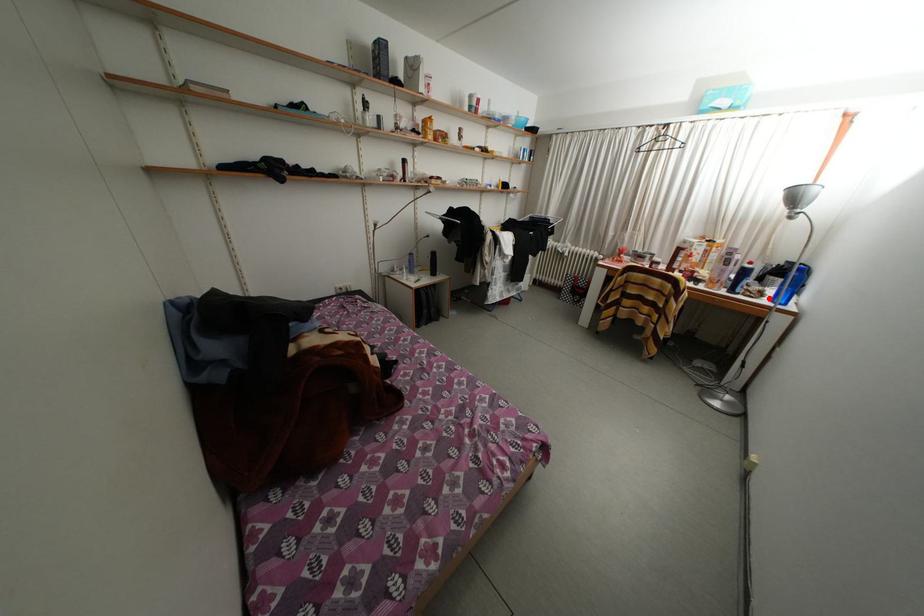
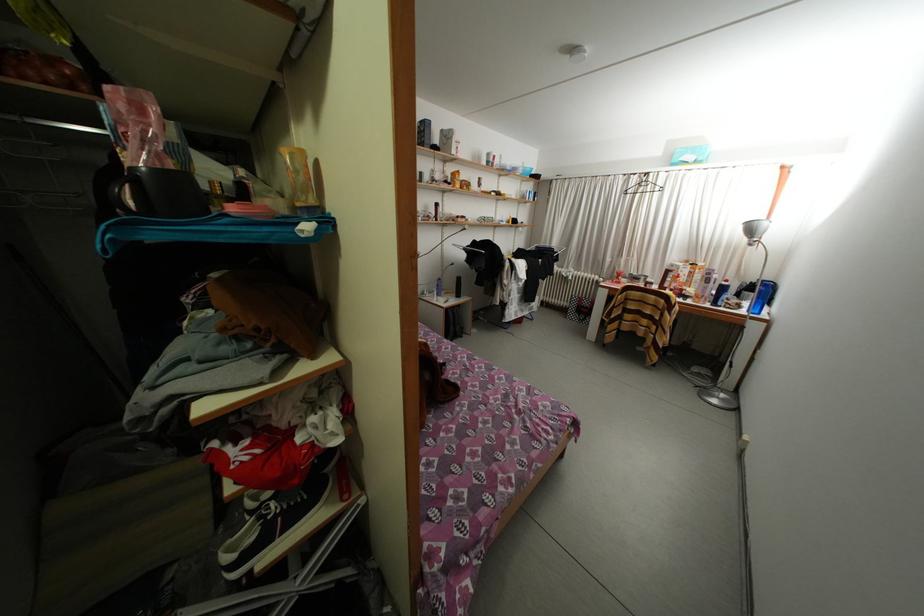
Where in the second image is the point corresponding to the highlighted location from the first image?

(747, 310)